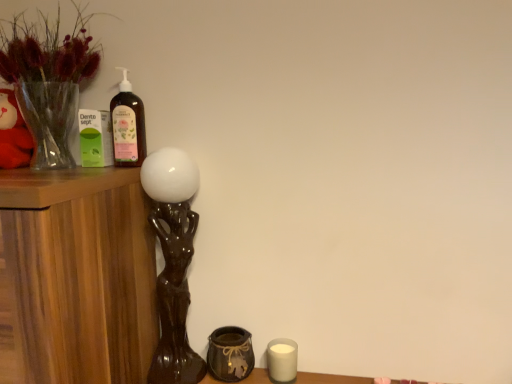
At what (x,y) coordinates should I click in order to perform the action: click on blank space situated above brown glossy table lamp at left (from a real-world perspective). Please return your answer as a coordinate pair (x, y). Image resolution: width=512 pixels, height=384 pixels. Looking at the image, I should click on (169, 157).